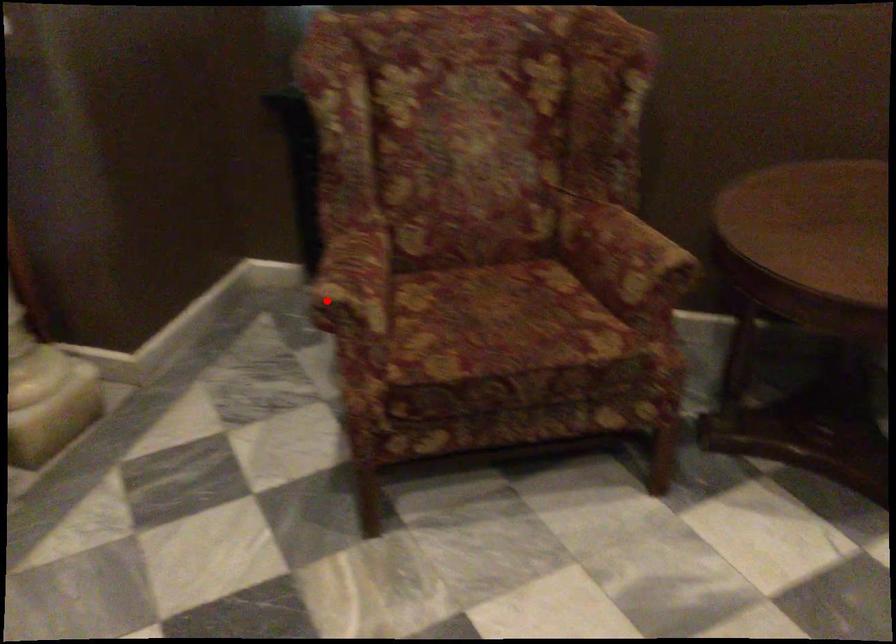
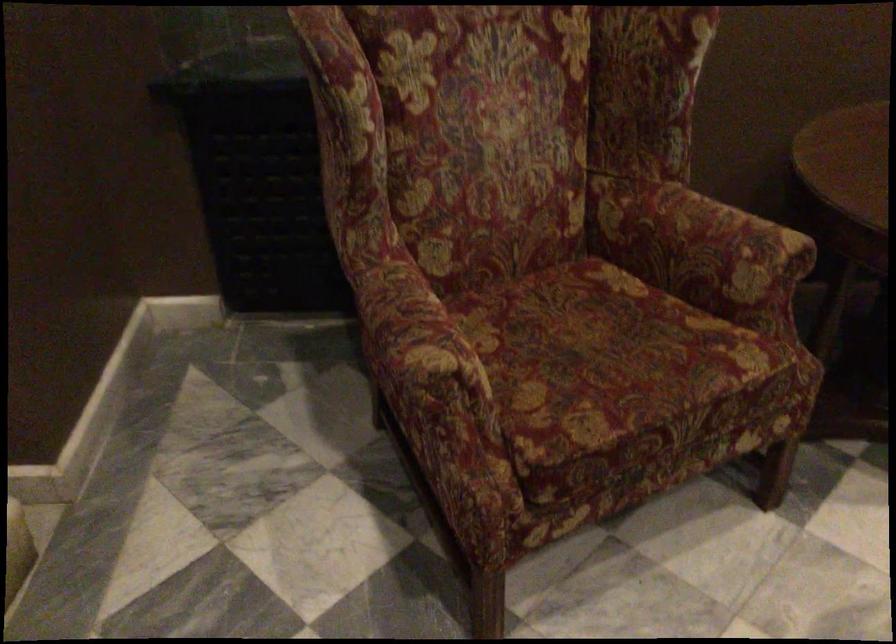
The point at the highlighted location is marked in the first image. Where is the corresponding point in the second image?

(428, 377)